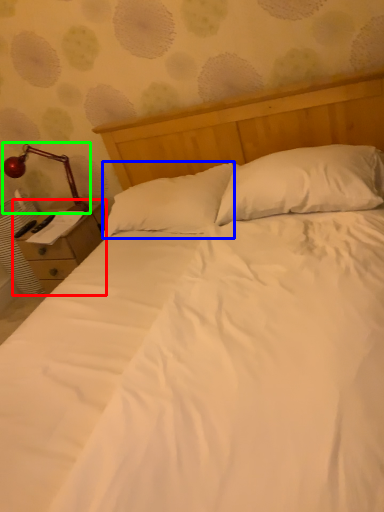
Question: Which object is the closest to the nightstand (highlighted by a red box)? Choose among these: pillow (highlighted by a blue box) or lamp (highlighted by a green box).

Choices:
 (A) pillow
 (B) lamp

Answer: (B)